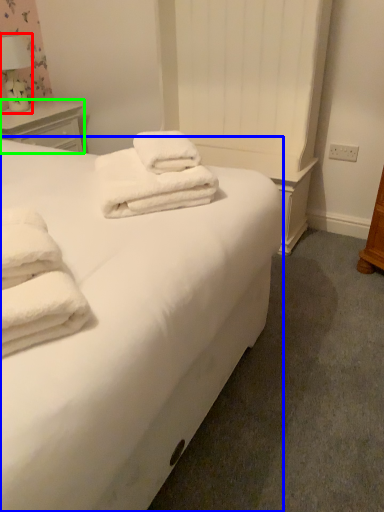
Question: Based on their relative distances, which object is farther from table lamp (highlighted by a red box)? Choose from bed (highlighted by a blue box) and nightstand (highlighted by a green box).

Choices:
 (A) bed
 (B) nightstand

Answer: (A)